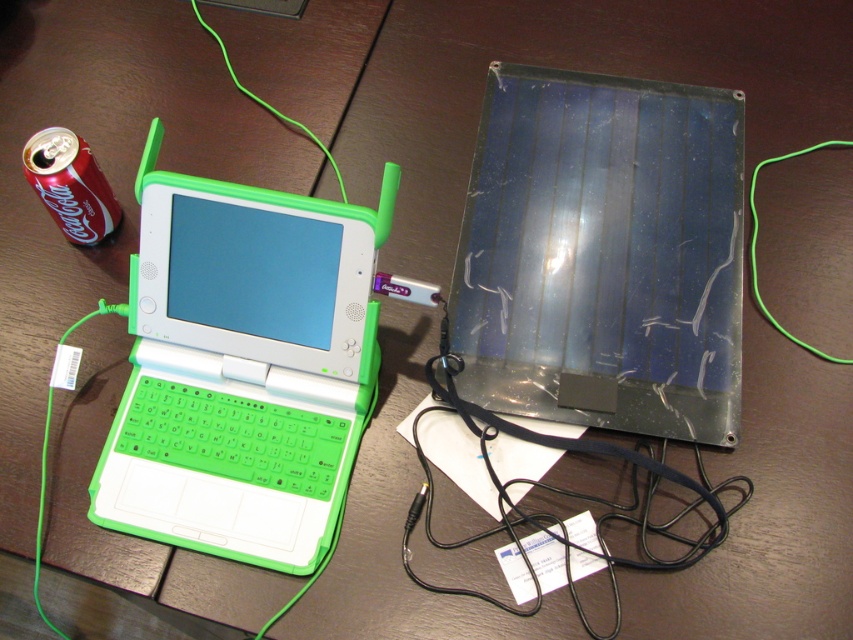
Does green matte laptop at left come in front of red matte can at left?

Yes, green matte laptop at left is in front of red matte can at left.

Find the location of a particular element. green matte laptop at left is located at coordinates (242, 369).

Does transparent plastic solar panel at center appear on the right side of red matte can at left?

Correct, you'll find transparent plastic solar panel at center to the right of red matte can at left.

Does transparent plastic solar panel at center have a smaller size compared to red matte can at left?

Actually, transparent plastic solar panel at center might be larger than red matte can at left.

What are the coordinates of `transparent plastic solar panel at center` in the screenshot? It's located at (602, 253).

Find the location of `transparent plastic solar panel at center`. transparent plastic solar panel at center is located at coordinates (602, 253).

Is transparent plastic solar panel at center to the left of green matte laptop at left from the viewer's perspective?

In fact, transparent plastic solar panel at center is to the right of green matte laptop at left.

The image size is (853, 640). What do you see at coordinates (602, 253) in the screenshot? I see `transparent plastic solar panel at center` at bounding box center [602, 253].

Identify the location of transparent plastic solar panel at center. The width and height of the screenshot is (853, 640). (602, 253).